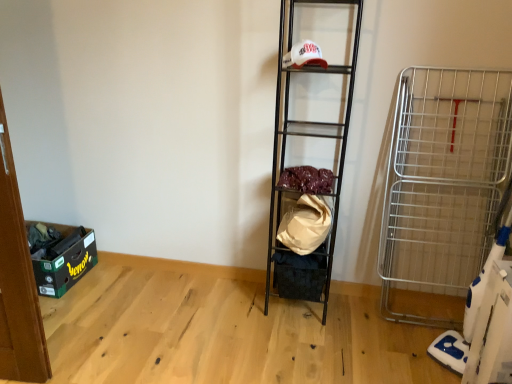
The image size is (512, 384). What do you see at coordinates (308, 158) in the screenshot?
I see `metallic black shelf at center` at bounding box center [308, 158].

In order to face black fabric storage box at center, the second storage box in the left-to-right sequence, should I rotate leftwards or rightwards?

Rotate your view right by about 6.462°.

The height and width of the screenshot is (384, 512). What do you see at coordinates (66, 267) in the screenshot?
I see `green cardboard storage box at lower left, placed as the 1th storage box when sorted from left to right` at bounding box center [66, 267].

In order to face green cardboard storage box at lower left, the 2th storage box positioned from the right, should I rotate leftwards or rightwards?

A 26.730 degree turn to the left will do.

Identify the location of velvet-like fabric at center, which appears as the second material when ordered from the bottom. (307, 179).

Would you say metallic black shelf at center is a long distance from silver metallic cart at right?

No, metallic black shelf at center is not far away from silver metallic cart at right.

Locate an element on the screen. This screenshot has width=512, height=384. shelf behind the silver metallic cart at right is located at coordinates (308, 158).

Can silver metallic cart at right be found inside metallic black shelf at center?

No, silver metallic cart at right is not a part of metallic black shelf at center.

Looking at this image, is silver metallic cart at right surrounded by beige fabric bag at center, acting as the first material starting from the bottom?

No, silver metallic cart at right is not a part of beige fabric bag at center, acting as the first material starting from the bottom.

What's the angular difference between beige fabric bag at center, acting as the first material starting from the bottom, and silver metallic cart at right's facing directions?

There is a 91-degree angle between the facing directions of beige fabric bag at center, acting as the first material starting from the bottom, and silver metallic cart at right.

Locate an element on the screen. cart that is below the beige fabric bag at center, acting as the first material starting from the bottom (from the image's perspective) is located at coordinates (443, 182).

Which of these two, beige fabric bag at center, which ranks as the 2th material in top-to-bottom order, or silver metallic cart at right, stands shorter?

beige fabric bag at center, which ranks as the 2th material in top-to-bottom order.

Based on the photo, would you say green cardboard storage box at lower left, placed as the 1th storage box when sorted from left to right, is part of beige fabric bag at center, which ranks as the 2th material in top-to-bottom order,'s contents?

That's incorrect, green cardboard storage box at lower left, placed as the 1th storage box when sorted from left to right, is not inside beige fabric bag at center, which ranks as the 2th material in top-to-bottom order.

Which is more to the left, beige fabric bag at center, which ranks as the 2th material in top-to-bottom order, or green cardboard storage box at lower left, the 2th storage box positioned from the right?

From the viewer's perspective, green cardboard storage box at lower left, the 2th storage box positioned from the right, appears more on the left side.

Is green cardboard storage box at lower left, placed as the 1th storage box when sorted from left to right, at the back of beige fabric bag at center, acting as the first material starting from the bottom?

No, beige fabric bag at center, acting as the first material starting from the bottom,'s orientation is not away from green cardboard storage box at lower left, placed as the 1th storage box when sorted from left to right.

From their relative heights in the image, would you say beige fabric bag at center, which ranks as the 2th material in top-to-bottom order, is taller or shorter than green cardboard storage box at lower left, the 2th storage box positioned from the right?

Considering their sizes, beige fabric bag at center, which ranks as the 2th material in top-to-bottom order, has more height than green cardboard storage box at lower left, the 2th storage box positioned from the right.

Is point (306, 289) positioned in front of point (331, 186)?

No, it is not.

Considering the relative sizes of black fabric storage box at center, the second storage box in the left-to-right sequence, and velvet-like fabric at center, acting as the first material starting from the top, in the image provided, is black fabric storage box at center, the second storage box in the left-to-right sequence, taller than velvet-like fabric at center, acting as the first material starting from the top,?

Yes.

From a real-world perspective, is black fabric storage box at center, the 1th storage box when ordered from right to left, under velvet-like fabric at center, which appears as the second material when ordered from the bottom?

Yes, from a real-world perspective, black fabric storage box at center, the 1th storage box when ordered from right to left, is below velvet-like fabric at center, which appears as the second material when ordered from the bottom.

Is black fabric storage box at center, the second storage box in the left-to-right sequence, smaller than velvet-like fabric at center, which appears as the second material when ordered from the bottom?

No, black fabric storage box at center, the second storage box in the left-to-right sequence, is not smaller than velvet-like fabric at center, which appears as the second material when ordered from the bottom.

Can you confirm if metallic black shelf at center is positioned to the left of black fabric storage box at center, the second storage box in the left-to-right sequence?

No, metallic black shelf at center is not to the left of black fabric storage box at center, the second storage box in the left-to-right sequence.

Between point (314, 281) and point (283, 279), which one is positioned in front?

Point (314, 281)

From a real-world perspective, between metallic black shelf at center and black fabric storage box at center, the second storage box in the left-to-right sequence, who is vertically higher?

metallic black shelf at center.

From the picture: Can you confirm if metallic black shelf at center is bigger than black fabric storage box at center, the second storage box in the left-to-right sequence?

Yes.

Is silver metallic cart at right aimed at metallic black shelf at center?

Yes, silver metallic cart at right is oriented towards metallic black shelf at center.

Where is `shelf lying behind the silver metallic cart at right`? The width and height of the screenshot is (512, 384). shelf lying behind the silver metallic cart at right is located at coordinates (308, 158).

From a real-world perspective, is silver metallic cart at right physically above metallic black shelf at center?

Actually, silver metallic cart at right is physically below metallic black shelf at center in the real world.

Consider the image. Which object is further away from the camera, silver metallic cart at right or metallic black shelf at center?

metallic black shelf at center is further from the camera.

Is beige fabric bag at center, which ranks as the 2th material in top-to-bottom order, bigger than metallic black shelf at center?

Incorrect, beige fabric bag at center, which ranks as the 2th material in top-to-bottom order, is not larger than metallic black shelf at center.

From a real-world perspective, is beige fabric bag at center, acting as the first material starting from the bottom, physically above metallic black shelf at center?

No, from a real-world perspective, beige fabric bag at center, acting as the first material starting from the bottom, is not above metallic black shelf at center.

Is beige fabric bag at center, which ranks as the 2th material in top-to-bottom order, wider or thinner than metallic black shelf at center?

Considering their sizes, beige fabric bag at center, which ranks as the 2th material in top-to-bottom order, looks slimmer than metallic black shelf at center.

This screenshot has width=512, height=384. What are the coordinates of `cart that is under the metallic black shelf at center (from a real-world perspective)` in the screenshot? It's located at (443, 182).

Identify the location of cart located in front of the beige fabric bag at center, which ranks as the 2th material in top-to-bottom order. (443, 182).

Looking at the image, which one is located closer to velvet-like fabric at center, acting as the first material starting from the top, black fabric storage box at center, the second storage box in the left-to-right sequence, or metallic black shelf at center?

metallic black shelf at center.

When comparing their distances from metallic black shelf at center, does velvet-like fabric at center, which appears as the second material when ordered from the bottom, or silver metallic cart at right seem closer?

velvet-like fabric at center, which appears as the second material when ordered from the bottom, is closer to metallic black shelf at center.

Estimate the real-world distances between objects in this image. Which object is closer to metallic black shelf at center, green cardboard storage box at lower left, the 2th storage box positioned from the right, or beige fabric bag at center, acting as the first material starting from the bottom?

Among the two, beige fabric bag at center, acting as the first material starting from the bottom, is located nearer to metallic black shelf at center.

Based on their spatial positions, is beige fabric bag at center, acting as the first material starting from the bottom, or metallic black shelf at center closer to green cardboard storage box at lower left, the 2th storage box positioned from the right?

beige fabric bag at center, acting as the first material starting from the bottom, is positioned closer to the anchor green cardboard storage box at lower left, the 2th storage box positioned from the right.

Looking at the image, which one is located further to beige fabric bag at center, which ranks as the 2th material in top-to-bottom order, metallic black shelf at center or silver metallic cart at right?

Based on the image, silver metallic cart at right appears to be further to beige fabric bag at center, which ranks as the 2th material in top-to-bottom order.

When comparing their distances from black fabric storage box at center, the second storage box in the left-to-right sequence, does silver metallic cart at right or velvet-like fabric at center, acting as the first material starting from the top, seem further?

silver metallic cart at right lies further to black fabric storage box at center, the second storage box in the left-to-right sequence, than the other object.

Estimate the real-world distances between objects in this image. Which object is closer to silver metallic cart at right, black fabric storage box at center, the 1th storage box when ordered from right to left, or green cardboard storage box at lower left, placed as the 1th storage box when sorted from left to right?

black fabric storage box at center, the 1th storage box when ordered from right to left, is closer to silver metallic cart at right.

Based on their spatial positions, is black fabric storage box at center, the second storage box in the left-to-right sequence, or velvet-like fabric at center, which appears as the second material when ordered from the bottom, closer to metallic black shelf at center?

velvet-like fabric at center, which appears as the second material when ordered from the bottom, is closer to metallic black shelf at center.

At what (x,y) coordinates should I click in order to perform the action: click on material between green cardboard storage box at lower left, placed as the 1th storage box when sorted from left to right, and velvet-like fabric at center, which appears as the second material when ordered from the bottom. Please return your answer as a coordinate pair (x, y). Image resolution: width=512 pixels, height=384 pixels. Looking at the image, I should click on (305, 224).

This screenshot has width=512, height=384. In order to click on shelf between velvet-like fabric at center, which appears as the second material when ordered from the bottom, and silver metallic cart at right in this screenshot , I will do `click(308, 158)`.

Locate an element on the screen. The height and width of the screenshot is (384, 512). storage box between beige fabric bag at center, acting as the first material starting from the bottom, and silver metallic cart at right from left to right is located at coordinates (298, 275).

Find the location of `shelf located between beige fabric bag at center, which ranks as the 2th material in top-to-bottom order, and silver metallic cart at right in the left-right direction`. shelf located between beige fabric bag at center, which ranks as the 2th material in top-to-bottom order, and silver metallic cart at right in the left-right direction is located at coordinates (308, 158).